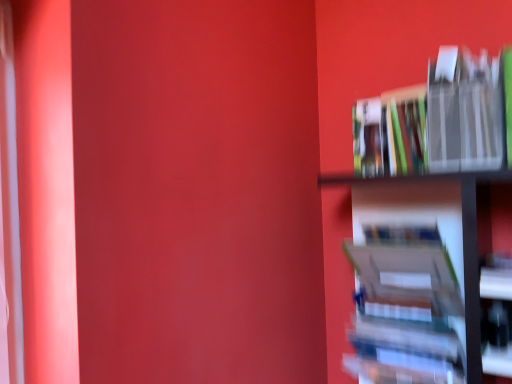
Question: Are hardcover book at right, the 3th book from the top, and hardcover book at upper right, placed as the 2th book when sorted from top to bottom, making contact?

Choices:
 (A) no
 (B) yes

Answer: (A)

Question: Can you confirm if hardcover book at right, which appears as the 1th book when ordered from the bottom, is positioned to the right of hardcover book at upper right, the 2th book when ordered from bottom to top?

Choices:
 (A) no
 (B) yes

Answer: (A)

Question: From a real-world perspective, is hardcover book at right, the 3th book from the top, located beneath hardcover book at upper right, the 2th book when ordered from bottom to top?

Choices:
 (A) yes
 (B) no

Answer: (A)

Question: Does hardcover book at right, the 3th book from the top, have a greater width compared to hardcover book at upper right, placed as the 2th book when sorted from top to bottom?

Choices:
 (A) no
 (B) yes

Answer: (B)

Question: Does hardcover book at right, which appears as the 1th book when ordered from the bottom, turn towards hardcover book at upper right, placed as the 2th book when sorted from top to bottom?

Choices:
 (A) yes
 (B) no

Answer: (B)

Question: Does hardcover book at right, which appears as the 1th book when ordered from the bottom, have a smaller size compared to hardcover book at upper right, placed as the 2th book when sorted from top to bottom?

Choices:
 (A) no
 (B) yes

Answer: (A)

Question: From the image's perspective, is metallic silver book at right, placed as the third book when sorted from bottom to top, above hardcover book at upper right, the 2th book when ordered from bottom to top?

Choices:
 (A) yes
 (B) no

Answer: (A)

Question: From the image's perspective, is metallic silver book at right, acting as the first book starting from the top, beneath hardcover book at upper right, the 2th book when ordered from bottom to top?

Choices:
 (A) yes
 (B) no

Answer: (B)

Question: Does metallic silver book at right, acting as the first book starting from the top, lie in front of hardcover book at upper right, the 2th book when ordered from bottom to top?

Choices:
 (A) yes
 (B) no

Answer: (A)

Question: From a real-world perspective, is metallic silver book at right, acting as the first book starting from the top, below hardcover book at upper right, placed as the 2th book when sorted from top to bottom?

Choices:
 (A) yes
 (B) no

Answer: (B)

Question: Can you confirm if metallic silver book at right, acting as the first book starting from the top, is positioned to the left of hardcover book at upper right, the 2th book when ordered from bottom to top?

Choices:
 (A) no
 (B) yes

Answer: (A)

Question: Does metallic silver book at right, placed as the third book when sorted from bottom to top, lie behind hardcover book at upper right, the 2th book when ordered from bottom to top?

Choices:
 (A) no
 (B) yes

Answer: (A)

Question: Considering the relative sizes of hardcover book at right, the 3th book from the top, and metallic silver book at right, acting as the first book starting from the top, in the image provided, is hardcover book at right, the 3th book from the top, bigger than metallic silver book at right, acting as the first book starting from the top,?

Choices:
 (A) no
 (B) yes

Answer: (B)